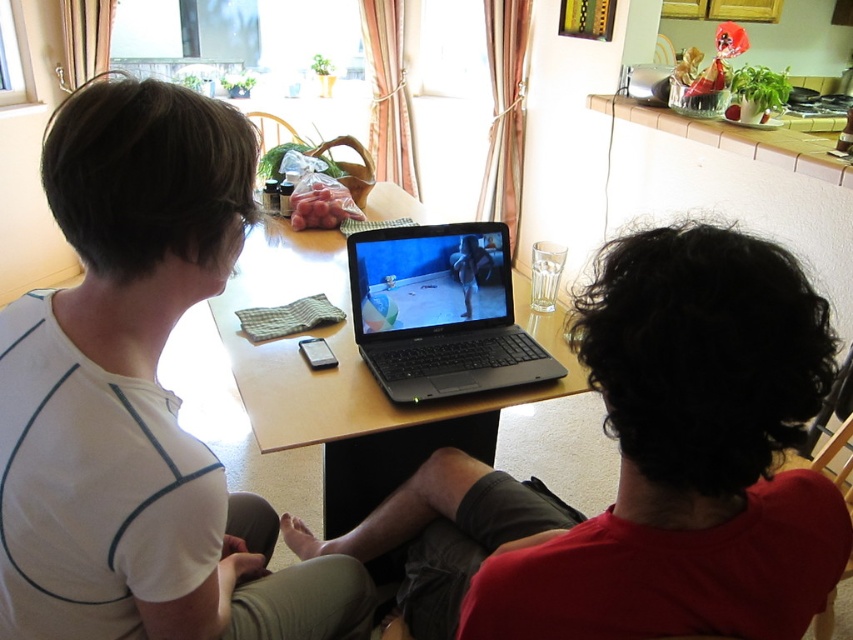
Question: Does white matte shirt at upper left have a smaller size compared to wooden table at center?

Choices:
 (A) no
 (B) yes

Answer: (B)

Question: Among these points, which one is nearest to the camera?

Choices:
 (A) (99, 90)
 (B) (482, 493)

Answer: (A)

Question: Which point is farther to the camera?

Choices:
 (A) white matte shirt at upper left
 (B) black matte laptop at center

Answer: (B)

Question: Which of the following is the farthest from the observer?

Choices:
 (A) (810, 316)
 (B) (337, 433)
 (C) (51, 429)
 (D) (454, 259)

Answer: (D)

Question: Can you confirm if white matte shirt at left is positioned below wooden table at center?

Choices:
 (A) yes
 (B) no

Answer: (A)

Question: Is white matte shirt at upper left below wooden table at center?

Choices:
 (A) no
 (B) yes

Answer: (B)